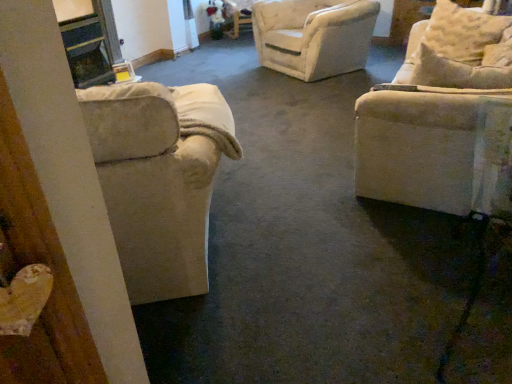
Where is `beige fabric couch at right, acting as the first chair starting from the right`? This screenshot has width=512, height=384. beige fabric couch at right, acting as the first chair starting from the right is located at coordinates (442, 118).

In the scene shown: Is beige fabric pillow at upper right thinner than beige fabric couch at right, positioned as the second chair in left-to-right order?

No.

In the scene shown: In the image, is beige fabric pillow at upper right positioned in front of or behind beige fabric couch at right, acting as the first chair starting from the right?

Clearly, beige fabric pillow at upper right is behind beige fabric couch at right, acting as the first chair starting from the right.

Looking at this image, considering the relative positions of beige fabric pillow at upper right and beige fabric couch at right, positioned as the second chair in left-to-right order, in the image provided, is beige fabric pillow at upper right to the right of beige fabric couch at right, positioned as the second chair in left-to-right order, from the viewer's perspective?

Yes.

Does beige fabric pillow at upper right have a greater height compared to beige fabric couch at right, positioned as the second chair in left-to-right order?

Yes, beige fabric pillow at upper right is taller than beige fabric couch at right, positioned as the second chair in left-to-right order.

Is beige fabric couch at right, acting as the first chair starting from the right, beside beige fabric pillow at upper right?

No, beige fabric couch at right, acting as the first chair starting from the right, is not touching beige fabric pillow at upper right.

From the image's perspective, which is below, beige fabric couch at right, positioned as the second chair in left-to-right order, or beige fabric pillow at upper right?

beige fabric couch at right, positioned as the second chair in left-to-right order, from the image's perspective.

Is beige fabric couch at right, acting as the first chair starting from the right, facing away from beige fabric pillow at upper right?

That's not correct — beige fabric couch at right, acting as the first chair starting from the right, is not looking away from beige fabric pillow at upper right.

Considering the relative sizes of beige fabric couch at right, acting as the first chair starting from the right, and beige fabric pillow at upper right in the image provided, is beige fabric couch at right, acting as the first chair starting from the right, taller than beige fabric pillow at upper right?

No, beige fabric couch at right, acting as the first chair starting from the right, is not taller than beige fabric pillow at upper right.

From a real-world perspective, which object stands above the other?

From a 3D spatial view, beige fabric couch at right, positioned as the second chair in left-to-right order, is above.

Can you confirm if beige fabric armchair at left, which is the first chair in left-to-right order, is smaller than beige fabric couch at right, acting as the first chair starting from the right?

Incorrect, beige fabric armchair at left, which is the first chair in left-to-right order, is not smaller in size than beige fabric couch at right, acting as the first chair starting from the right.

You are a GUI agent. You are given a task and a screenshot of the screen. Output one action in this format:
    pyautogui.click(x=<x>, y=<y>)
    Task: Click on the chair that appears in front of the beige fabric couch at right, acting as the first chair starting from the right
    This screenshot has width=512, height=384.
    Given the screenshot: What is the action you would take?
    pyautogui.click(x=159, y=179)

Which of these two, beige fabric armchair at left, marked as the second chair in a right-to-left arrangement, or beige fabric couch at right, acting as the first chair starting from the right, stands shorter?

beige fabric couch at right, acting as the first chair starting from the right, is shorter.

From the image's perspective, is beige fabric pillow at upper right on beige fabric armchair at left, which is the first chair in left-to-right order?

Correct, beige fabric pillow at upper right appears higher than beige fabric armchair at left, which is the first chair in left-to-right order, in the image.

From the picture: Is beige fabric pillow at upper right smaller than beige fabric armchair at left, marked as the second chair in a right-to-left arrangement?

Yes.

In the scene shown: How far apart are beige fabric pillow at upper right and beige fabric armchair at left, which is the first chair in left-to-right order?

The distance of beige fabric pillow at upper right from beige fabric armchair at left, which is the first chair in left-to-right order, is 7.34 feet.

Between beige fabric pillow at upper right and beige fabric armchair at left, which is the first chair in left-to-right order, which one appears on the left side from the viewer's perspective?

beige fabric armchair at left, which is the first chair in left-to-right order, is more to the left.

From the image's perspective, is beige fabric armchair at left, which is the first chair in left-to-right order, above beige fabric pillow at upper right?

No.

Consider the image. From a real-world perspective, which object rests below the other?

beige fabric armchair at left, which is the first chair in left-to-right order.

Locate an element on the screen. The width and height of the screenshot is (512, 384). the 2nd chair below the beige fabric pillow at upper right (from the image's perspective) is located at coordinates (159, 179).

Where is `chair on the left side of beige fabric couch at right, positioned as the second chair in left-to-right order`? Image resolution: width=512 pixels, height=384 pixels. chair on the left side of beige fabric couch at right, positioned as the second chair in left-to-right order is located at coordinates (159, 179).

Is beige fabric couch at right, positioned as the second chair in left-to-right order, shorter than beige fabric armchair at left, marked as the second chair in a right-to-left arrangement?

Indeed, beige fabric couch at right, positioned as the second chair in left-to-right order, has a lesser height compared to beige fabric armchair at left, marked as the second chair in a right-to-left arrangement.

Is beige fabric couch at right, positioned as the second chair in left-to-right order, aimed at beige fabric armchair at left, which is the first chair in left-to-right order?

No.

Considering the sizes of beige fabric couch at right, acting as the first chair starting from the right, and beige fabric armchair at left, which is the first chair in left-to-right order, in the image, is beige fabric couch at right, acting as the first chair starting from the right, wider or thinner than beige fabric armchair at left, which is the first chair in left-to-right order,?

In the image, beige fabric couch at right, acting as the first chair starting from the right, appears to be more narrow than beige fabric armchair at left, which is the first chair in left-to-right order.

Where is `pillow on the right of beige fabric couch at right, acting as the first chair starting from the right`? This screenshot has height=384, width=512. pillow on the right of beige fabric couch at right, acting as the first chair starting from the right is located at coordinates click(462, 32).

Where is `pillow lying above the beige fabric couch at right, acting as the first chair starting from the right (from the image's perspective)`? pillow lying above the beige fabric couch at right, acting as the first chair starting from the right (from the image's perspective) is located at coordinates (462, 32).

Based on their spatial positions, is beige fabric couch at right, positioned as the second chair in left-to-right order, or beige fabric pillow at upper right closer to beige fabric armchair at left, marked as the second chair in a right-to-left arrangement?

beige fabric couch at right, positioned as the second chair in left-to-right order, is positioned closer to the anchor beige fabric armchair at left, marked as the second chair in a right-to-left arrangement.

Estimate the real-world distances between objects in this image. Which object is closer to beige fabric armchair at left, which is the first chair in left-to-right order, beige fabric pillow at upper right or beige fabric couch at right, acting as the first chair starting from the right?

Among the two, beige fabric couch at right, acting as the first chair starting from the right, is located nearer to beige fabric armchair at left, which is the first chair in left-to-right order.

Which object lies further to the anchor point beige fabric couch at right, acting as the first chair starting from the right, beige fabric pillow at upper right or beige fabric armchair at left, marked as the second chair in a right-to-left arrangement?

beige fabric pillow at upper right.

Looking at the image, which one is located closer to beige fabric couch at right, positioned as the second chair in left-to-right order, beige fabric armchair at left, which is the first chair in left-to-right order, or beige fabric pillow at upper right?

beige fabric armchair at left, which is the first chair in left-to-right order.

Considering their positions, is beige fabric couch at right, acting as the first chair starting from the right, positioned further to beige fabric pillow at upper right than beige fabric armchair at left, marked as the second chair in a right-to-left arrangement?

beige fabric armchair at left, marked as the second chair in a right-to-left arrangement, lies further to beige fabric pillow at upper right than the other object.

Which object lies further to the anchor point beige fabric pillow at upper right, beige fabric armchair at left, which is the first chair in left-to-right order, or beige fabric couch at right, positioned as the second chair in left-to-right order?

beige fabric armchair at left, which is the first chair in left-to-right order, is positioned further to the anchor beige fabric pillow at upper right.

The image size is (512, 384). Identify the location of chair located between beige fabric armchair at left, marked as the second chair in a right-to-left arrangement, and beige fabric pillow at upper right in the left-right direction. (442, 118).